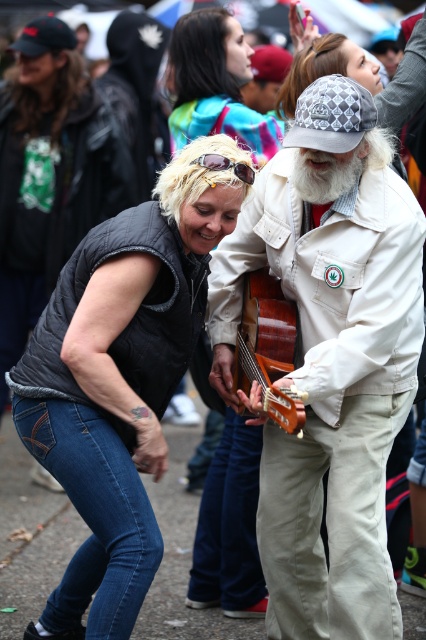
You are a photographer trying to capture a closeup of the multicolored fabric at upper center and the gold reflective sunglasses at upper center in the scene. Since you want both items to appear clearly in the photo, which object should you focus on to ensure the larger one is sharp?

You should focus on the multicolored fabric at upper center because it has a larger size compared to the gold reflective sunglasses at upper center, ensuring the bigger object is in focus.

What is located at the coordinate point (215, 84) in the image?

The multicolored fabric at upper center is located at point (215, 84).

You are a photographer trying to capture a candid shot of the whitewoollybeard at center and the wooden acoustic guitar at center. Since you want to include both in the frame, which object should you position closer to the left side of your camera viewfinder?

The wooden acoustic guitar at center should be positioned closer to the left side of the camera viewfinder because it is already located to the left of the whitewoollybeard at center in the scene.